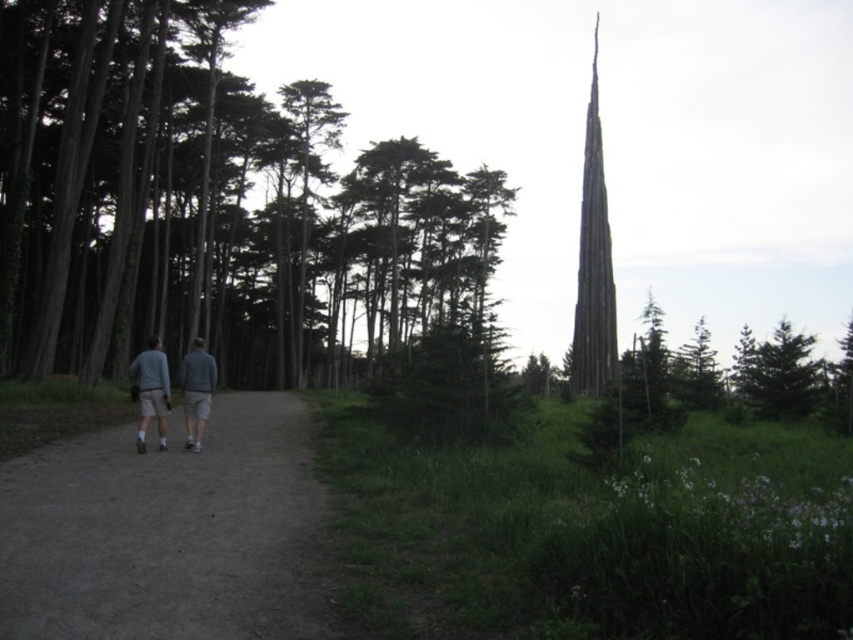
Does gray cotton shorts at center have a greater width compared to gray matte shirt at center?

Correct, the width of gray cotton shorts at center exceeds that of gray matte shirt at center.

Which is in front, point (154, 388) or point (202, 372)?

Point (154, 388) is more forward.

Is point (144, 428) closer to camera compared to point (189, 432)?

Yes, point (144, 428) is in front of point (189, 432).

Identify the location of gray cotton shorts at center. (151, 390).

This screenshot has height=640, width=853. What are the coordinates of `smooth bark tree at center` in the screenshot? It's located at (231, 220).

Who is positioned more to the left, smooth bark tree at center or gray cotton shorts at center?

smooth bark tree at center is more to the left.

Find the location of a particular element. The image size is (853, 640). smooth bark tree at center is located at coordinates (231, 220).

Identify the location of smooth bark tree at center. (231, 220).

What do you see at coordinates (593, 262) in the screenshot? I see `smooth gray spire at upper right` at bounding box center [593, 262].

Which is more to the left, smooth gray spire at upper right or gray cotton shorts at center?

gray cotton shorts at center

Describe the element at coordinates (593, 262) in the screenshot. This screenshot has width=853, height=640. I see `smooth gray spire at upper right` at that location.

The image size is (853, 640). Identify the location of smooth gray spire at upper right. (593, 262).